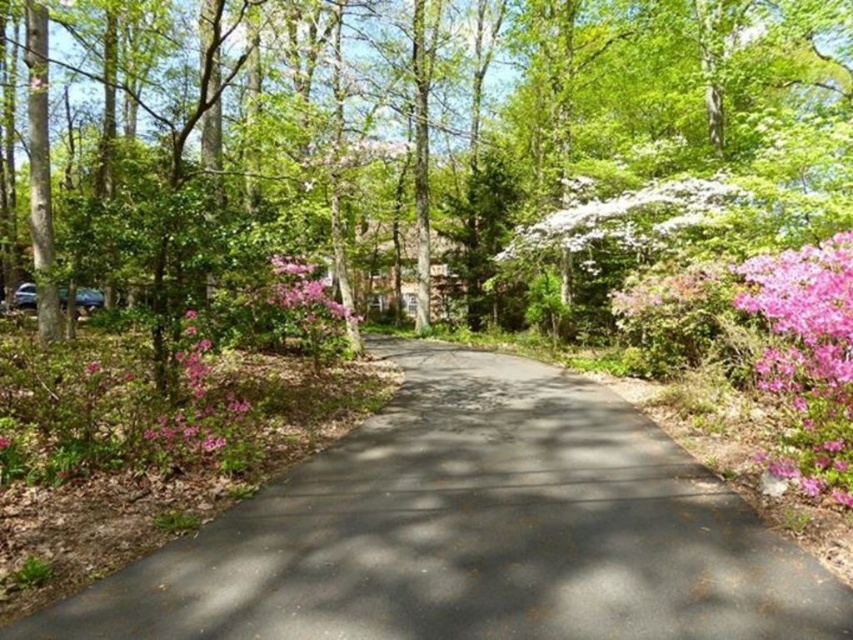
You are a gardener with a 5 meter long hose. You need to water both the green leafy tree at center and the white fluffy flowers at center. Can your hose reach both from your current position at the start of the driveway?

The distance between the green leafy tree at center and white fluffy flowers at center is 5.01 meters. Since your hose is only 5 meters long, it cannot reach both locations from your current position.

You are a gardener planning to plant a new tree in the center of the driveway. The existing green leafy tree at center and white fluffy flowers at center are already present. Which one should you avoid removing to ensure there is enough space for the new tree?

You should avoid removing the green leafy tree at center because it is bigger than the white fluffy flowers at center, so removing the smaller white fluffy flowers at center would leave more space for the new tree.